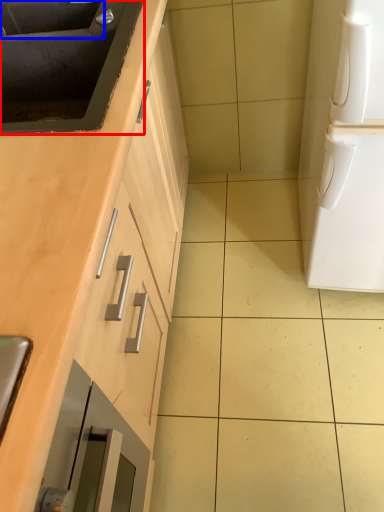
Question: Which object appears farthest to the camera in this image, sink (highlighted by a red box) or sink (highlighted by a blue box)?

Choices:
 (A) sink
 (B) sink

Answer: (B)